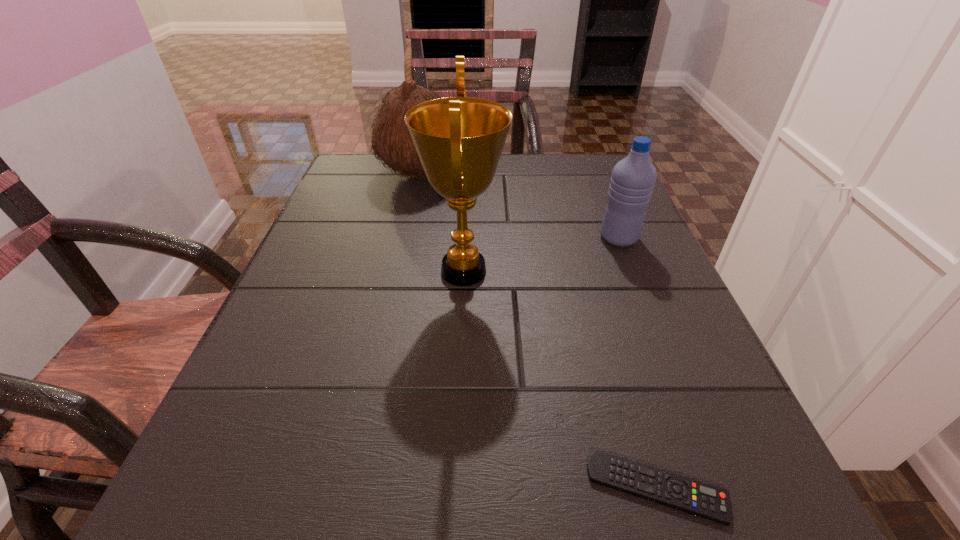
This screenshot has width=960, height=540. Identify the location of vacant area that lies between the shortest object and the award. (561, 379).

Where is `vacant space that's between the farthest object and the nearest object`? vacant space that's between the farthest object and the nearest object is located at coordinates (538, 331).

This screenshot has width=960, height=540. What are the coordinates of `free space between the third shortest object and the award` in the screenshot? It's located at (441, 222).

The height and width of the screenshot is (540, 960). I want to click on free point between the water bottle and the award, so click(x=541, y=254).

Find the location of `vacant area that lies between the coconut and the award`. vacant area that lies between the coconut and the award is located at coordinates (441, 222).

This screenshot has height=540, width=960. What are the coordinates of `object that is the closest to the water bottle` in the screenshot? It's located at (459, 140).

This screenshot has height=540, width=960. Find the location of `object identified as the second closest to the water bottle`. object identified as the second closest to the water bottle is located at coordinates (392, 141).

You are a GUI agent. You are given a task and a screenshot of the screen. Output one action in this format:
    pyautogui.click(x=<x>, y=<y>)
    Task: Click on the vacant point that satisfies the following two spatial constraints: 1. on the back side of the water bottle; 2. on the left side of the remote control
    Image resolution: width=960 pixels, height=540 pixels.
    Given the screenshot: What is the action you would take?
    pyautogui.click(x=583, y=238)

I want to click on vacant area in the image that satisfies the following two spatial constraints: 1. on the front view with handles of the remote control; 2. on the left side of the award, so click(x=454, y=488).

Locate an element on the screen. free space that satisfies the following two spatial constraints: 1. on the back side of the water bottle; 2. on the right side of the shortest object is located at coordinates (583, 238).